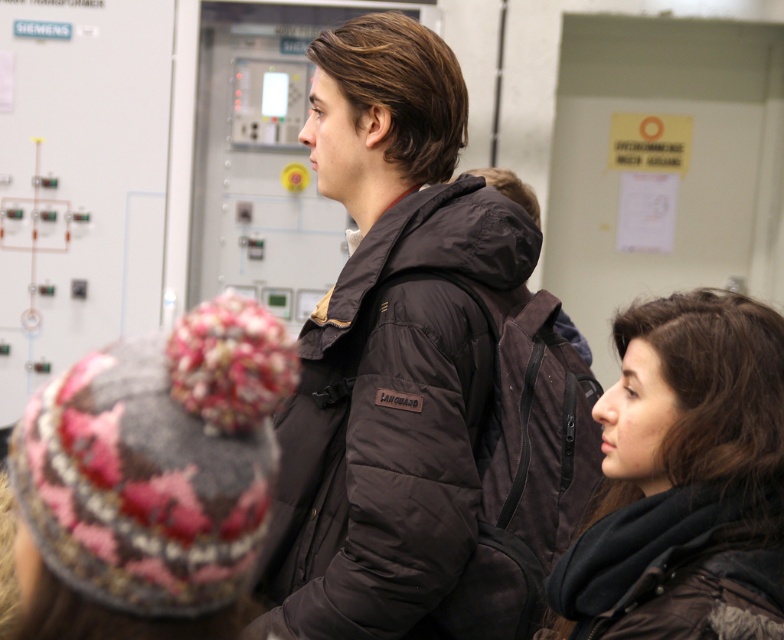
Is dark brown puffer jacket at center below dark brown hair at center?

No.

Does point (443, 150) come behind point (692, 452)?

Yes, point (443, 150) is farther from viewer.

Find the location of a particular element. The image size is (784, 640). dark brown puffer jacket at center is located at coordinates (387, 348).